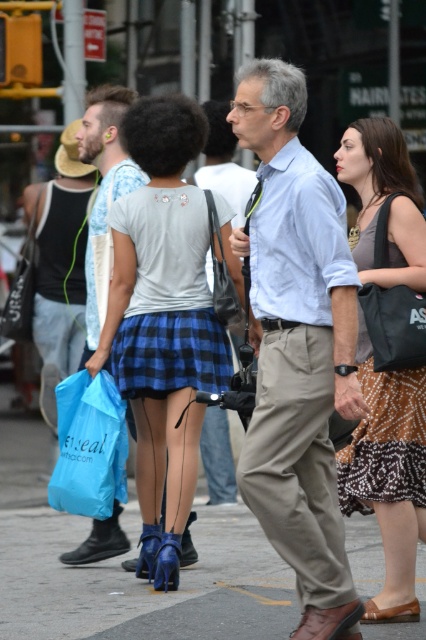
You are standing at the center of the image and want to locate the khaki pants at center. What are their coordinates?

The khaki pants at center are located at coordinates point (298, 348).

You are a fashion designer observing the two skirts in the scene. Which skirt, the matte blue skirt at center or the blue plaid skirt at center, is taller?

The matte blue skirt at center is taller than the blue plaid skirt at center.